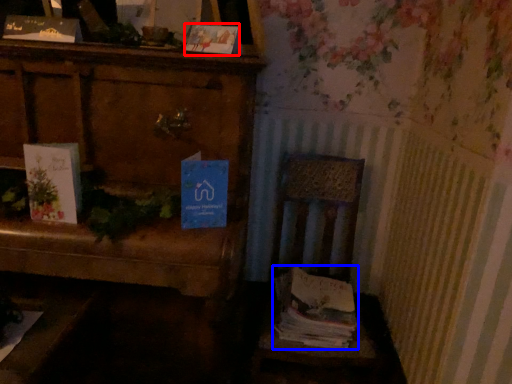
Question: Which of the following is the closest to the observer, paperback book (highlighted by a red box) or magazine (highlighted by a blue box)?

Choices:
 (A) paperback book
 (B) magazine

Answer: (A)